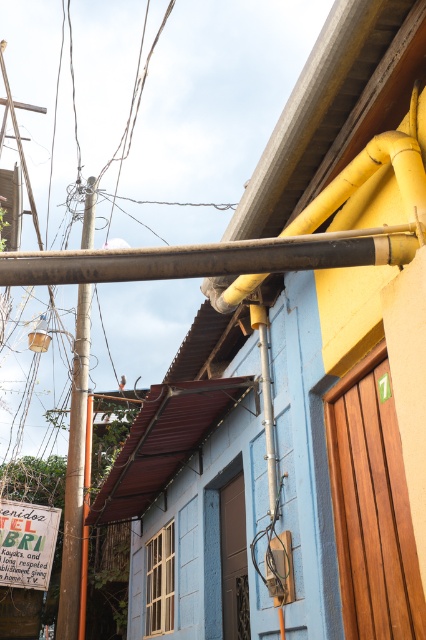
Question: Is black matte pipe at upper center further to camera compared to smooth brown pole at left?

Choices:
 (A) no
 (B) yes

Answer: (A)

Question: From the image, what is the correct spatial relationship of black matte pipe at upper center in relation to smooth brown pole at left?

Choices:
 (A) below
 (B) above

Answer: (B)

Question: Which of the following is the farthest from the observer?

Choices:
 (A) black matte pipe at upper center
 (B) smooth brown pole at left

Answer: (B)

Question: Is black matte pipe at upper center to the left of smooth brown pole at left from the viewer's perspective?

Choices:
 (A) no
 (B) yes

Answer: (A)

Question: Which point is farther from the camera taking this photo?

Choices:
 (A) [342, 259]
 (B) [74, 451]

Answer: (B)

Question: Which point is closer to the camera?

Choices:
 (A) (86, 330)
 (B) (32, 273)

Answer: (B)